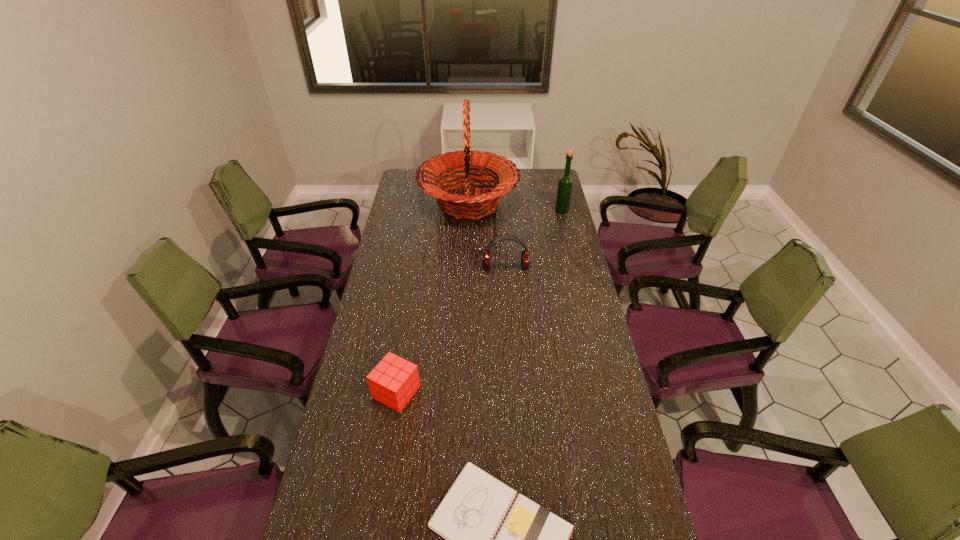
Locate an element on the screen. free spot between the second tallest object and the fourth tallest object is located at coordinates (479, 301).

Locate an element on the screen. This screenshot has width=960, height=540. free space between the basket and the second tallest object is located at coordinates (516, 207).

Find the location of `blank region between the third nearest object and the fourth farthest object`. blank region between the third nearest object and the fourth farthest object is located at coordinates (451, 330).

Where is `unoccupied area between the basket and the fourth farthest object`? This screenshot has width=960, height=540. unoccupied area between the basket and the fourth farthest object is located at coordinates (432, 298).

Image resolution: width=960 pixels, height=540 pixels. In order to click on empty space between the tallest object and the second nearest object in this screenshot , I will do `click(432, 298)`.

Identify the location of unoccupied area between the earphone and the fourth shortest object. (534, 239).

Locate an element on the screen. This screenshot has height=540, width=960. empty location between the third shortest object and the fourth tallest object is located at coordinates (451, 330).

You are a GUI agent. You are given a task and a screenshot of the screen. Output one action in this format:
    pyautogui.click(x=<x>, y=<y>)
    Task: Click on the free point between the basket and the earphone
    This screenshot has height=540, width=960.
    Given the screenshot: What is the action you would take?
    pyautogui.click(x=488, y=235)

Identify which object is located as the third nearest to the liquor. Please provide its 2D coordinates. Your answer should be formatted as a tuple, i.e. [(x, y)], where the tuple contains the x and y coordinates of a point satisfying the conditions above.

[(393, 382)]

Identify which object is the fourth nearest to the liquor. Please provide its 2D coordinates. Your answer should be formatted as a tuple, i.e. [(x, y)], where the tuple contains the x and y coordinates of a point satisfying the conditions above.

[(532, 539)]